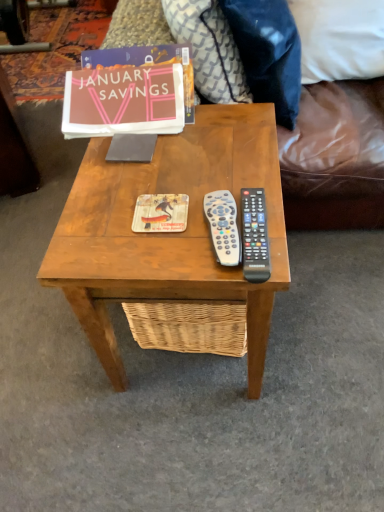
Where is `vacant space behind white plastic remote at center, arranged as the 2th remote control when viewed from the right`? vacant space behind white plastic remote at center, arranged as the 2th remote control when viewed from the right is located at coordinates (208, 169).